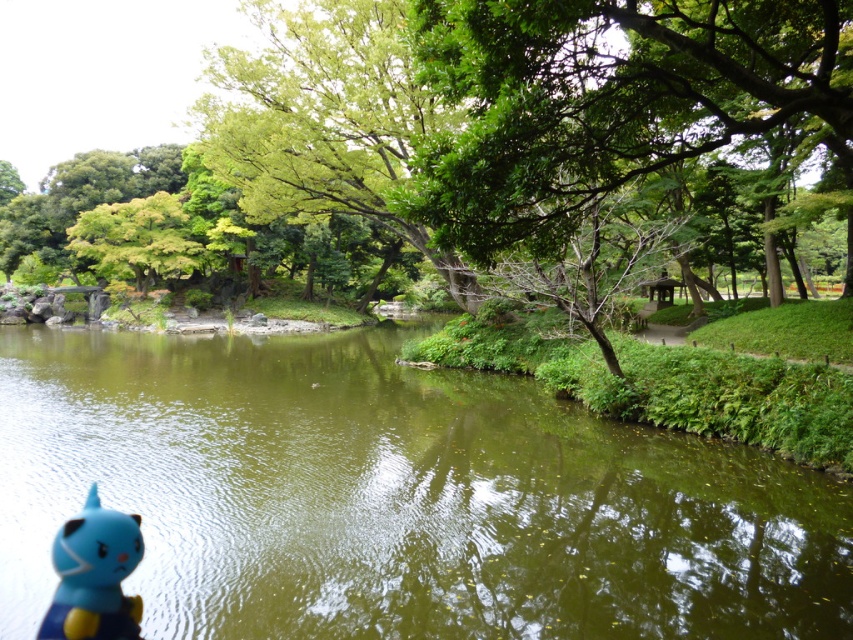
Between green glossy water at center and green leafy tree at upper left, which one appears on the right side from the viewer's perspective?

From the viewer's perspective, green glossy water at center appears more on the right side.

Does point (192, 586) come closer to viewer compared to point (148, 228)?

Yes, it is.

Which is in front, point (753, 556) or point (163, 234)?

Point (753, 556) is in front.

Where is `green glossy water at center`? green glossy water at center is located at coordinates (396, 497).

Who is positioned more to the right, green glossy water at center or blue matte toy at lower left?

blue matte toy at lower left is more to the right.

Is point (827, 532) behind point (71, 566)?

Yes.

This screenshot has width=853, height=640. I want to click on green glossy water at center, so click(396, 497).

This screenshot has height=640, width=853. What are the coordinates of `blue matte toy at lower left` in the screenshot? It's located at (94, 576).

Who is positioned more to the left, blue matte toy at lower left or green leafy tree at upper left?

From the viewer's perspective, green leafy tree at upper left appears more on the left side.

Which is behind, point (83, 589) or point (167, 256)?

The point (167, 256) is more distant.

The width and height of the screenshot is (853, 640). What are the coordinates of `blue matte toy at lower left` in the screenshot? It's located at (94, 576).